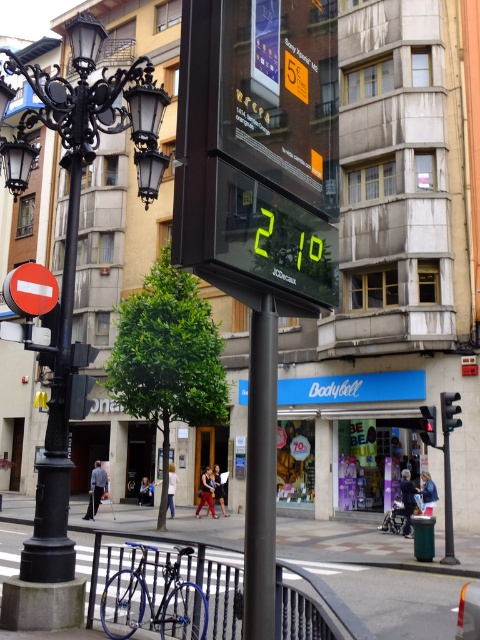
Is smooth concrete pavement at center smaller than black plastic pole at center?

No.

Where is `smooth concrete pavement at center`? This screenshot has width=480, height=640. smooth concrete pavement at center is located at coordinates (375, 580).

Identify the location of smooth concrete pavement at center. (375, 580).

How far apart are blue matte bodybell store at center and black plastic pole at center?

blue matte bodybell store at center is 8.11 meters from black plastic pole at center.

Looking at this image, is blue matte bodybell store at center further to camera compared to black plastic pole at center?

Yes, blue matte bodybell store at center is behind black plastic pole at center.

Is point (304, 465) positioned before point (445, 563)?

No, it is behind (445, 563).

Where is `blue matte bodybell store at center`? Image resolution: width=480 pixels, height=640 pixels. blue matte bodybell store at center is located at coordinates (348, 436).

Is point (418, 586) in front of point (432, 417)?

Yes, point (418, 586) is in front of point (432, 417).

Can you confirm if smooth concrete pavement at center is positioned to the left of black plastic traffic light at center?

Yes, smooth concrete pavement at center is to the left of black plastic traffic light at center.

Is point (10, 568) positioned behind point (428, 432)?

No.

Locate an element on the screen. This screenshot has height=640, width=480. smooth concrete pavement at center is located at coordinates (375, 580).